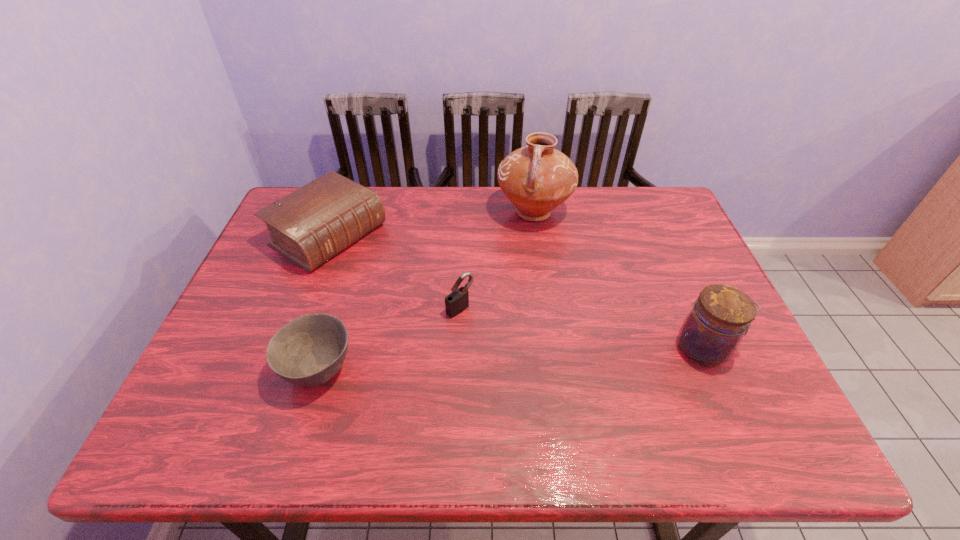
Find the location of `bowl`. bowl is located at coordinates (308, 351).

Identify the location of the second tallest object. The image size is (960, 540). (712, 331).

Where is `the rightmost object`? the rightmost object is located at coordinates (712, 331).

Find the location of a particular element. the tallest object is located at coordinates (537, 178).

Where is `the fourth object from left to right`? The width and height of the screenshot is (960, 540). the fourth object from left to right is located at coordinates (537, 178).

This screenshot has width=960, height=540. Identify the location of the third nearest object. (456, 302).

Locate an element on the screen. This screenshot has width=960, height=540. the third object from left to right is located at coordinates (456, 302).

This screenshot has height=540, width=960. What are the coordinates of `Bible` in the screenshot? It's located at (311, 225).

Where is `free point located 0.260m on the right of the bowl`? The image size is (960, 540). free point located 0.260m on the right of the bowl is located at coordinates (470, 369).

In order to click on vacant space situated 0.170m on the side of the fourth object from left to right with the handle in this screenshot , I will do `click(507, 271)`.